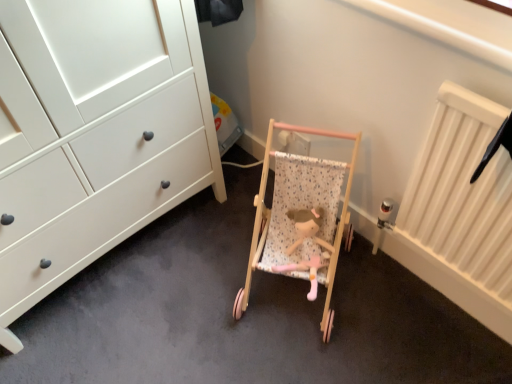
At what (x,y) coordinates should I click in order to perform the action: click on free space in front of wooden stroller at center. Please return your answer as a coordinate pair (x, y). This screenshot has width=512, height=384. Looking at the image, I should click on (312, 359).